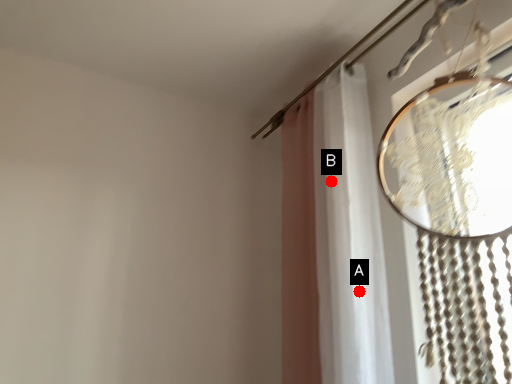
Question: Two points are circled on the image, labeled by A and B beside each circle. Which of the following is the farthest from the observer?

Choices:
 (A) A is further
 (B) B is further

Answer: (B)